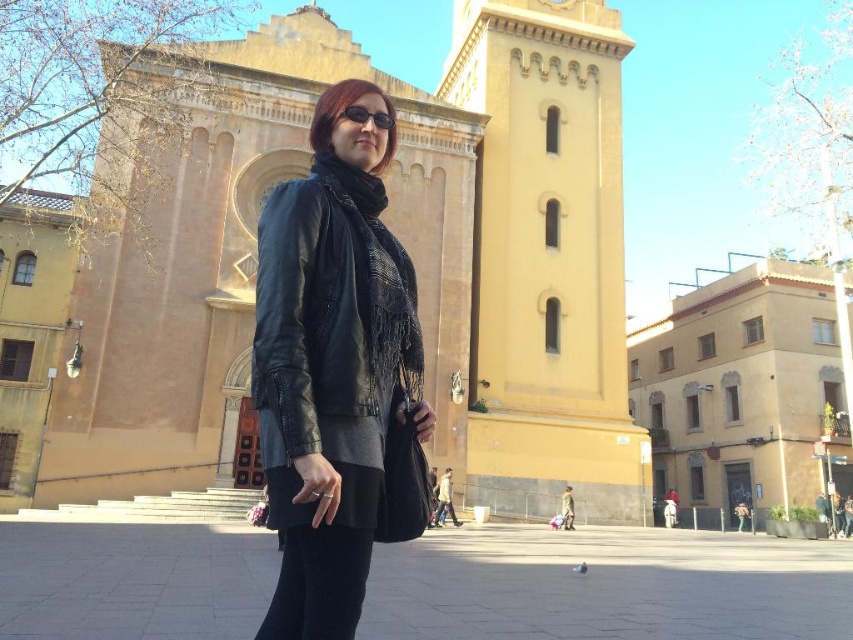
Does matte yellow church at center appear under black textured scarf at center?

No, matte yellow church at center is not below black textured scarf at center.

The width and height of the screenshot is (853, 640). What do you see at coordinates (410, 257) in the screenshot?
I see `matte yellow church at center` at bounding box center [410, 257].

Describe the element at coordinates (410, 257) in the screenshot. I see `matte yellow church at center` at that location.

You are a GUI agent. You are given a task and a screenshot of the screen. Output one action in this format:
    pyautogui.click(x=<x>, y=<y>)
    Task: Click on the matte yellow church at center
    This screenshot has width=853, height=640.
    Given the screenshot: What is the action you would take?
    pyautogui.click(x=410, y=257)

Is matte yellow church at center shorter than yellow matte tower at center?

Yes.

Between point (525, 20) and point (531, 3), which one is positioned in front?

Point (525, 20)

Is point (88, 456) more distant than point (611, 369)?

No, (88, 456) is in front of (611, 369).

Where is `matte yellow church at center`? Image resolution: width=853 pixels, height=640 pixels. matte yellow church at center is located at coordinates (410, 257).

Does matte yellow church at center have a greater height compared to black matte sunglasses at center?

Yes, matte yellow church at center is taller than black matte sunglasses at center.

Image resolution: width=853 pixels, height=640 pixels. Describe the element at coordinates (410, 257) in the screenshot. I see `matte yellow church at center` at that location.

Find the location of a particular element. The height and width of the screenshot is (640, 853). matte yellow church at center is located at coordinates (410, 257).